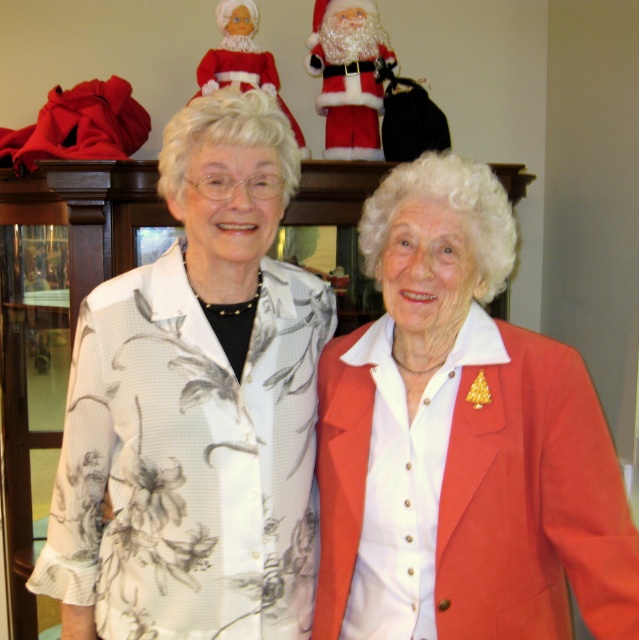
Does point (493, 234) lie behind point (320, 60)?

No, (493, 234) is in front of (320, 60).

Is matte red blazer at center to the left of fuzzy santa at upper center from the viewer's perspective?

Incorrect, matte red blazer at center is not on the left side of fuzzy santa at upper center.

Is point (603, 541) behind point (328, 124)?

No, (603, 541) is closer to viewer.

I want to click on matte red blazer at center, so click(461, 440).